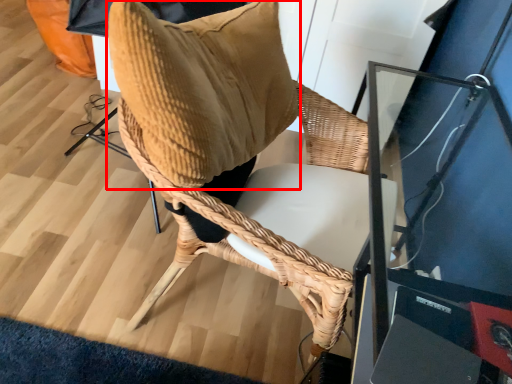
Question: Considering the relative positions of bean bag chair (annotated by the red box) and chair in the image provided, where is bean bag chair (annotated by the red box) located with respect to the staircase?

Choices:
 (A) left
 (B) right

Answer: (A)